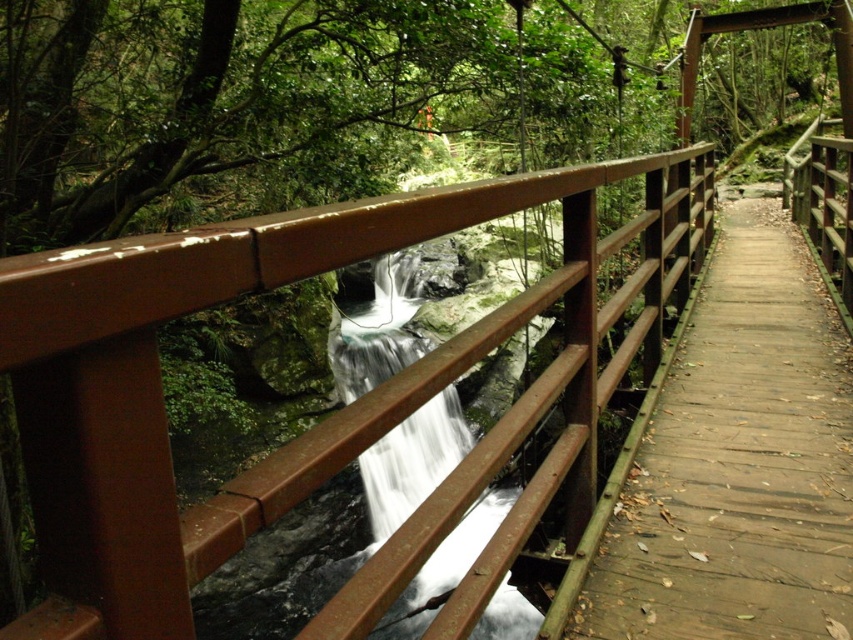
You are a painter who wants to paint the brown wooden rail at center and the wooden planks at center. You have a limited amount of paint. Which object requires more paint to cover its entire surface?

The wooden planks at center require more paint because their width is greater than the brown wooden rail at center.

You are a hiker crossing the wooden bridge and notice the wooden planks at center and the white smooth water at center. Which object is positioned higher relative to the other?

The wooden planks at center are located above the white smooth water at center, so the wooden planks at center are positioned higher.

You are standing on the wooden planks at center of the bridge and want to grab the brown wooden rail at center to steady yourself. Which direction should you move your hand to reach it?

The brown wooden rail at center is further to the viewer than wooden planks at center, so you should move your hand forward to reach it.